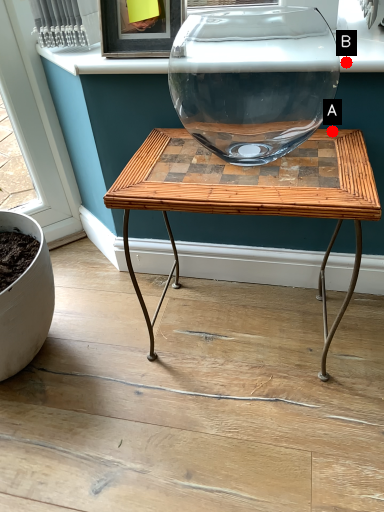
Question: Two points are circled on the image, labeled by A and B beside each circle. Which point is closer to the camera?

Choices:
 (A) A is closer
 (B) B is closer

Answer: (B)